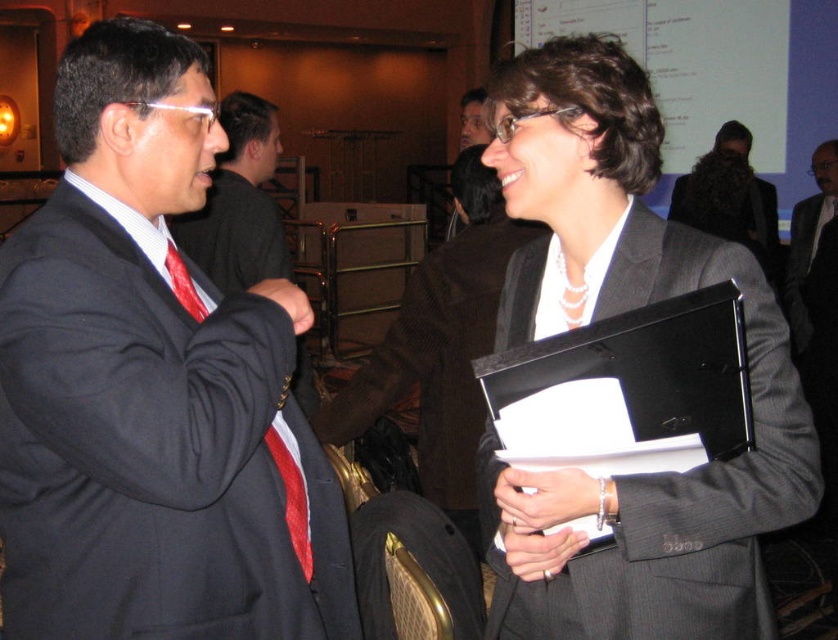
You are organizing a photo shoot and need to arrange the matte black suit at left and the dark brown wool suit at center in a row. Given their sizes, which suit should be placed first to ensure they fit within the available space?

The matte black suit at left occupies less space than the dark brown wool suit at center, so it should be placed first to accommodate both suits within the space.

You are attending a conference and want to approach both the matte black suit at left and the dark brown wool suit at center for a discussion. Which person should you approach first to reach them in the shortest path?

You should approach the matte black suit at left first because it is closer to you than the dark brown wool suit at center, so the shortest path is to the matte black suit at left.